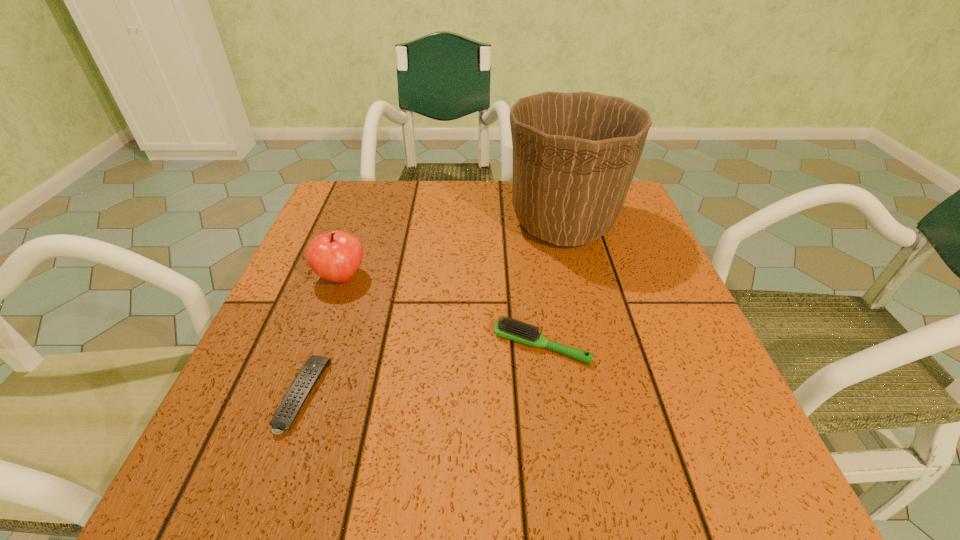
Locate an element on the screen. The image size is (960, 540). flowerpot is located at coordinates (575, 154).

Where is `the farthest object`? The width and height of the screenshot is (960, 540). the farthest object is located at coordinates (575, 154).

I want to click on the third nearest object, so click(335, 256).

You are a GUI agent. You are given a task and a screenshot of the screen. Output one action in this format:
    pyautogui.click(x=<x>, y=<y>)
    Task: Click on the second tallest object
    The width and height of the screenshot is (960, 540).
    Given the screenshot: What is the action you would take?
    pyautogui.click(x=335, y=256)

The width and height of the screenshot is (960, 540). What are the coordinates of `hairbrush` in the screenshot? It's located at [509, 328].

Identify the location of the shortest object. The width and height of the screenshot is (960, 540). (294, 399).

Locate an element on the screen. The image size is (960, 540). vacant space located on the front of the farthest object is located at coordinates (586, 312).

The height and width of the screenshot is (540, 960). What are the coordinates of `free space located 0.210m on the right of the second farthest object` in the screenshot? It's located at (472, 278).

Locate an element on the screen. vacant region located on the left of the second shortest object is located at coordinates (313, 345).

Locate an element on the screen. Image resolution: width=960 pixels, height=540 pixels. free space located on the left of the shortest object is located at coordinates (245, 395).